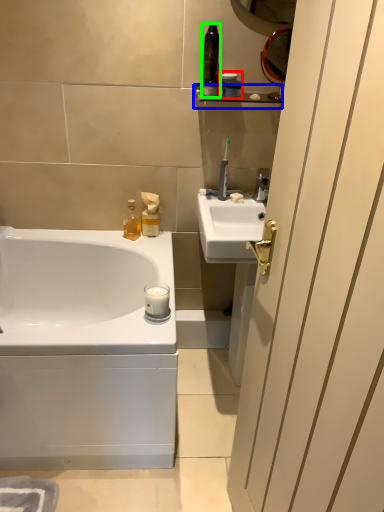
Question: Which object is the closest to the toiletry (highlighted by a red box)? Choose among these: balustrade (highlighted by a blue box) or toiletry (highlighted by a green box).

Choices:
 (A) balustrade
 (B) toiletry

Answer: (A)